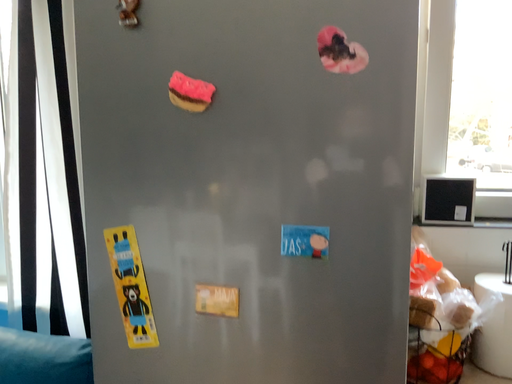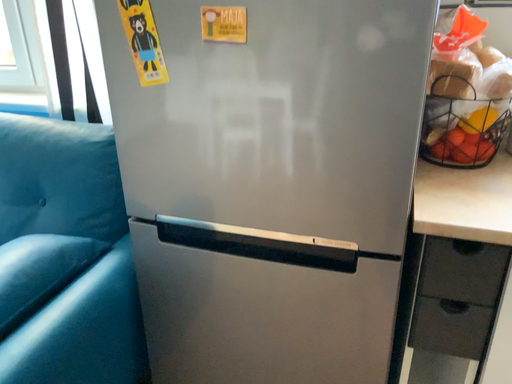
Question: Which way did the camera rotate in the video?

Choices:
 (A) rotated upward
 (B) rotated downward

Answer: (B)